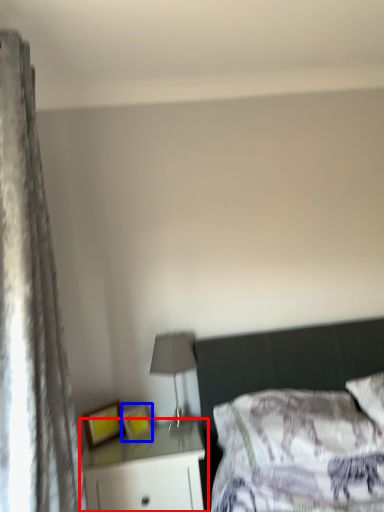
Question: Which point is closer to the camera, nightstand (highlighted by a red box) or picture frame (highlighted by a blue box)?

Choices:
 (A) nightstand
 (B) picture frame

Answer: (A)